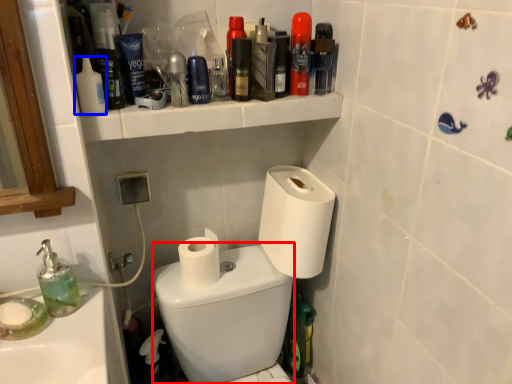
Question: Which object is closer to the camera taking this photo, bidet (highlighted by a red box) or mouthwash (highlighted by a blue box)?

Choices:
 (A) bidet
 (B) mouthwash

Answer: (A)